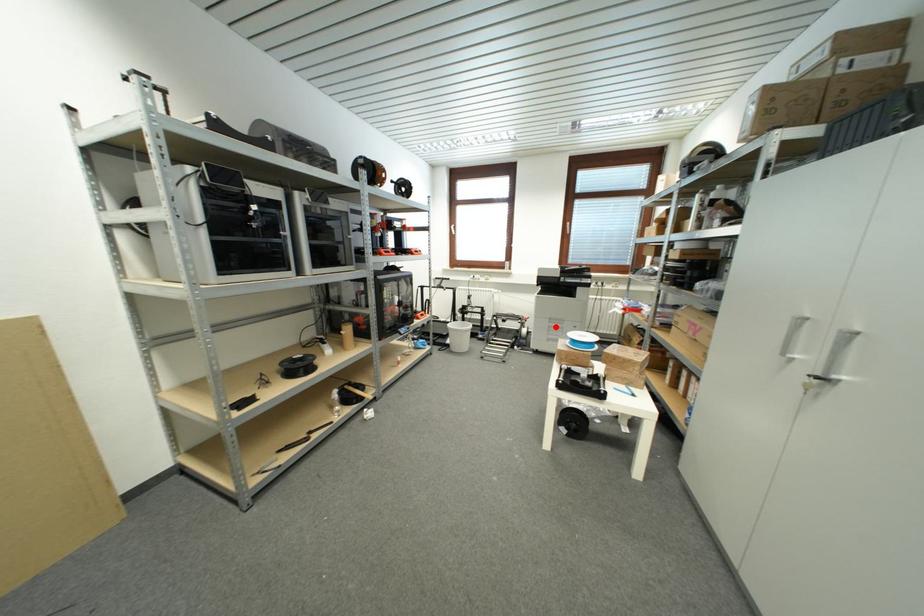
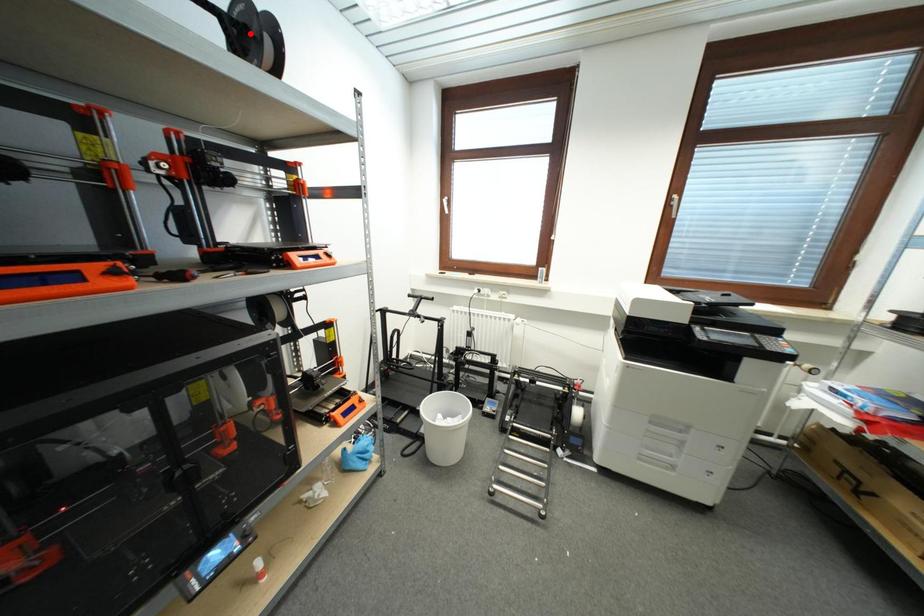
I am providing you with two images of the same scene from different viewpoints. A red point is marked on the first image and another point is marked on the second image. Do the highlighted points in image1 and image2 indicate the same real-world spot?

No